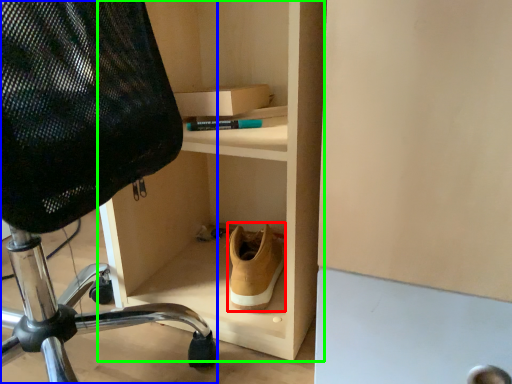
Question: Which object is positioned closest to shoe (highlighted by a red box)? Select from chair (highlighted by a blue box) and shelf (highlighted by a green box).

Choices:
 (A) chair
 (B) shelf

Answer: (B)